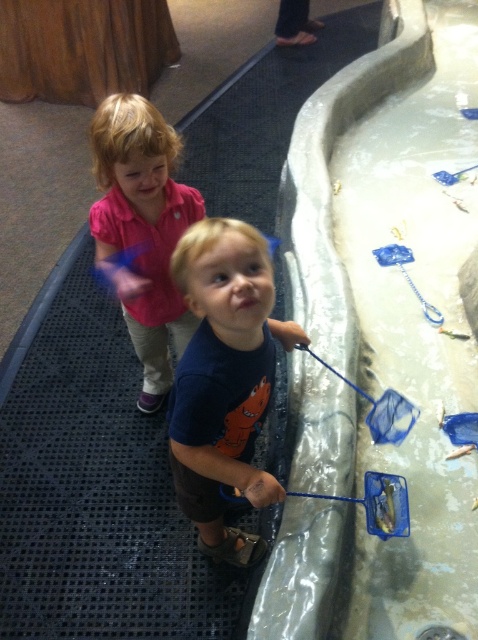
You are a parent trying to ensure your child stays dry while playing in the play area. The clear plastic water at upper right and the blue cotton shirt at center are in the scene. Which object is wider and could potentially cover more area, making it a concern for splashes?

The clear plastic water at upper right is wider than the blue cotton shirt at center, so it could cover more area and pose a greater splash concern.